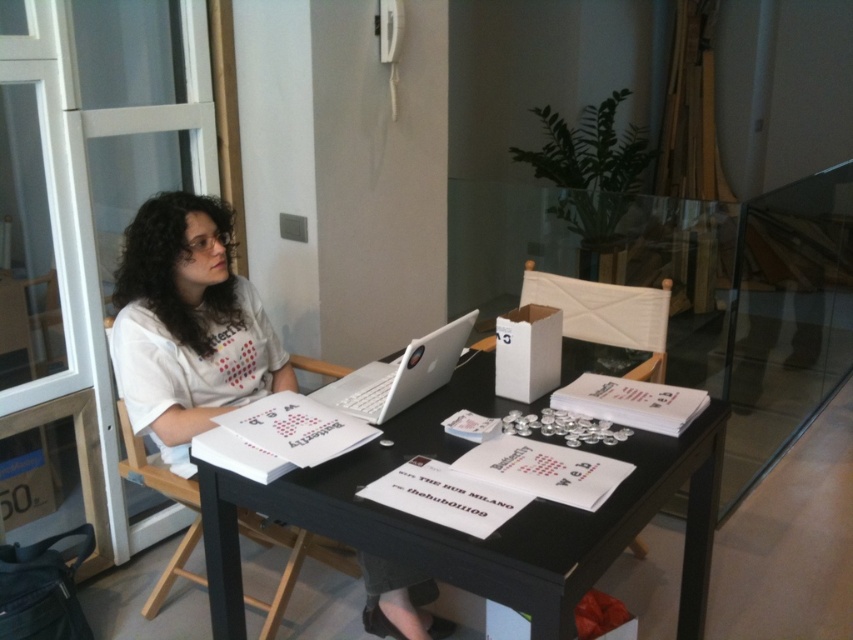
Does transparent glass table at center have a greater height compared to silver metallic laptop at center?

Yes, transparent glass table at center is taller than silver metallic laptop at center.

Is point (463, 189) positioned in front of point (386, 364)?

No.

In order to click on transparent glass table at center in this screenshot , I will do `click(753, 307)`.

Between transparent glass table at center and white cotton shirt at center, which one appears on the right side from the viewer's perspective?

From the viewer's perspective, transparent glass table at center appears more on the right side.

Who is more forward, (836, 224) or (131, 372)?

Point (131, 372) is in front.

Is point (447, 288) positioned after point (164, 312)?

Yes, point (447, 288) is farther from viewer.

At what (x,y) coordinates should I click in order to perform the action: click on transparent glass table at center. Please return your answer as a coordinate pair (x, y). Looking at the image, I should click on (753, 307).

Does transparent glass table at center have a greater height compared to black glossy table at center?

Correct, transparent glass table at center is much taller as black glossy table at center.

Does point (787, 266) lie behind point (225, 504)?

Yes.

In order to click on transparent glass table at center in this screenshot , I will do `click(753, 307)`.

This screenshot has height=640, width=853. What are the coordinates of `transparent glass table at center` in the screenshot? It's located at (753, 307).